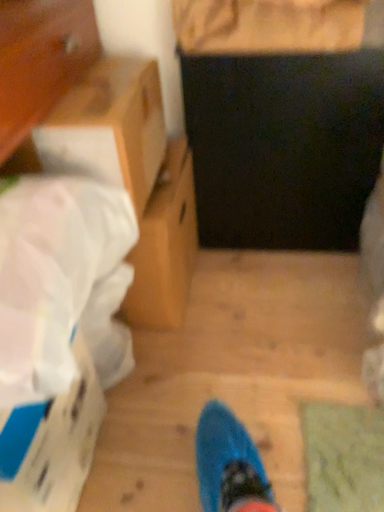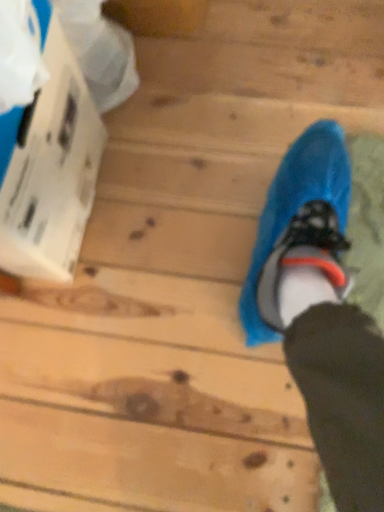
Question: How did the camera likely rotate when shooting the video?

Choices:
 (A) rotated upward
 (B) rotated downward

Answer: (B)